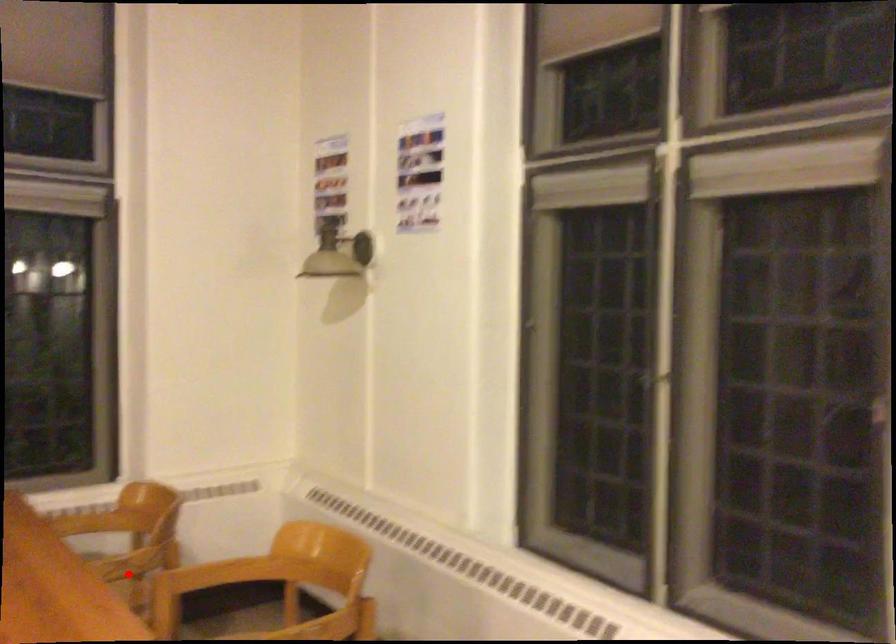
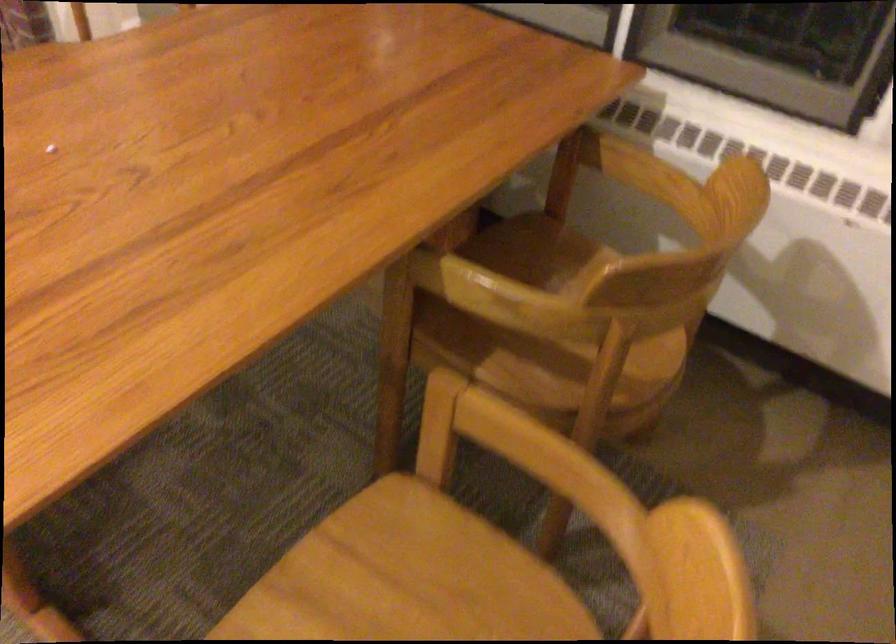
Question: I am providing you with two images of the same scene from different viewpoints. Image1 has a red point marked. In image2, the corresponding 3D location appears at what relative position? Reply with the corresponding letter.

Choices:
 (A) Closer
 (B) Farther

Answer: (A)